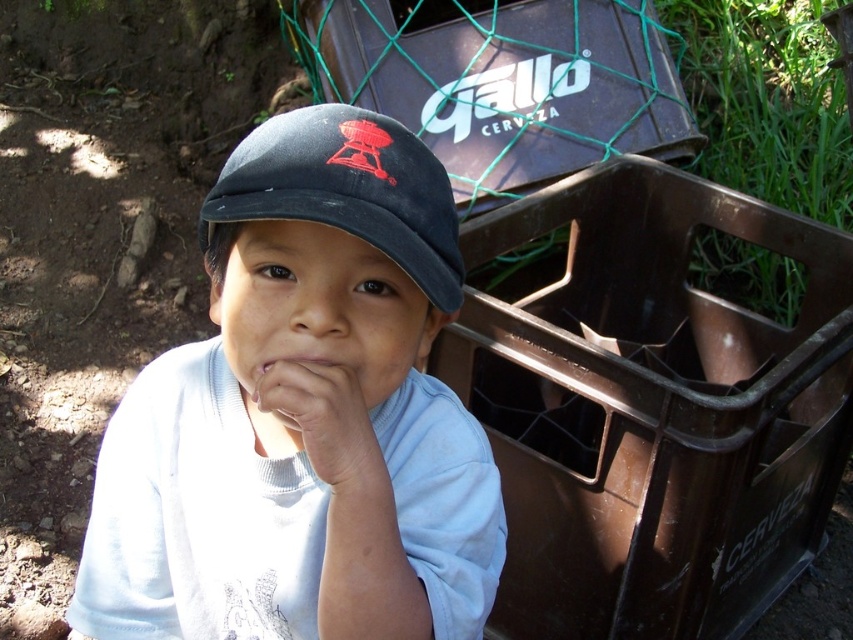
You are a photographer taking a picture of the black fabric cap at center and the white matte hand at center. Which object should you focus on first if you want to capture both in sharp focus, considering their sizes?

The black fabric cap at center has a greater height compared to the white matte hand at center, so you should focus on the larger object first to ensure both are in sharp focus.

You are standing 1 meter away from the point at coordinates (416, 492). Can you reach the point without moving your feet?

The distance of point (416, 492) from viewer is 72.81 centimeters, so yes, you can reach the point without moving your feet since it is closer than 1 meter.